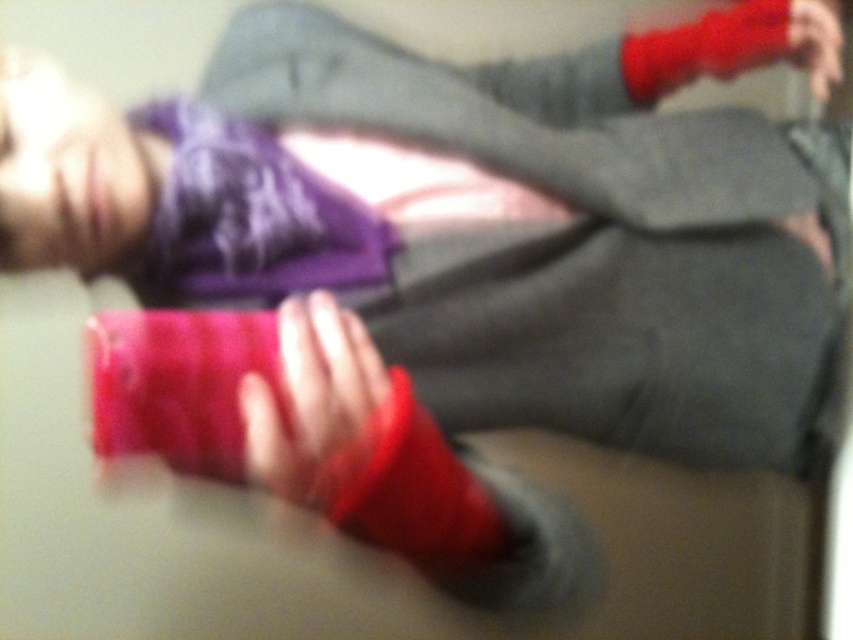
Question: Which point is farther to the camera?

Choices:
 (A) (756, 150)
 (B) (833, 54)
 (C) (354, 385)

Answer: (A)

Question: Does matte gray pants at center come behind matte red sock at upper right?

Choices:
 (A) no
 (B) yes

Answer: (A)

Question: Which point is farther to the camera?

Choices:
 (A) matte red sock at upper right
 (B) matte red sock at center

Answer: (A)

Question: Does matte red sock at center lie behind matte red sock at upper right?

Choices:
 (A) yes
 (B) no

Answer: (B)

Question: Among these objects, which one is nearest to the camera?

Choices:
 (A) matte gray pants at center
 (B) matte red sock at upper right

Answer: (A)

Question: Can you confirm if matte gray pants at center is thinner than matte red sock at center?

Choices:
 (A) no
 (B) yes

Answer: (A)